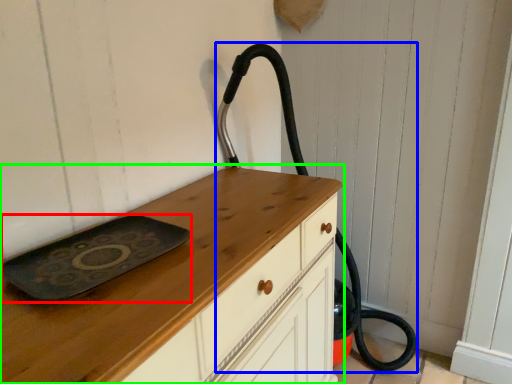
Question: Considering the real-world distances, which object is farthest from tray (highlighted by a red box)? fire hose (highlighted by a blue box) or chest of drawers (highlighted by a green box)?

Choices:
 (A) fire hose
 (B) chest of drawers

Answer: (A)